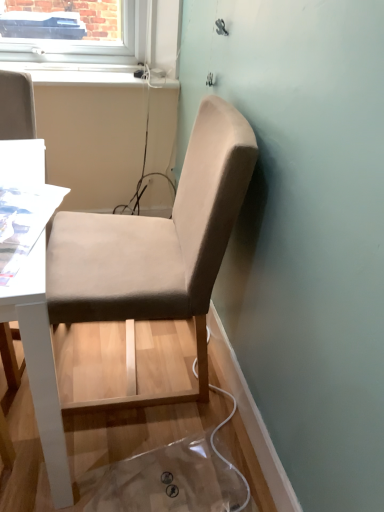
Question: Can you confirm if white plastic window sill at upper center is shorter than beige fabric chair at center?

Choices:
 (A) no
 (B) yes

Answer: (B)

Question: Is white plastic window sill at upper center wider than beige fabric chair at center?

Choices:
 (A) no
 (B) yes

Answer: (A)

Question: Is white plastic window sill at upper center at the left side of beige fabric chair at center?

Choices:
 (A) yes
 (B) no

Answer: (A)

Question: Is the depth of white plastic window sill at upper center greater than that of beige fabric chair at center?

Choices:
 (A) no
 (B) yes

Answer: (B)

Question: Does white plastic window sill at upper center touch beige fabric chair at center?

Choices:
 (A) no
 (B) yes

Answer: (A)

Question: Is white plastic window sill at upper center smaller than beige fabric chair at center?

Choices:
 (A) no
 (B) yes

Answer: (B)

Question: From the image's perspective, is beige fabric chair at center on white plastic window sill at upper center?

Choices:
 (A) no
 (B) yes

Answer: (A)

Question: From the image's perspective, is beige fabric chair at center located beneath white plastic window sill at upper center?

Choices:
 (A) yes
 (B) no

Answer: (A)

Question: Is beige fabric chair at center taller than white plastic window sill at upper center?

Choices:
 (A) no
 (B) yes

Answer: (B)

Question: Is beige fabric chair at center positioned behind white plastic window sill at upper center?

Choices:
 (A) no
 (B) yes

Answer: (A)

Question: Does beige fabric chair at center have a lesser height compared to white plastic window sill at upper center?

Choices:
 (A) no
 (B) yes

Answer: (A)

Question: Is beige fabric chair at center aimed at white plastic window sill at upper center?

Choices:
 (A) yes
 (B) no

Answer: (B)

Question: From the image's perspective, is beige fabric chair at center located above or below white plastic window sill at upper center?

Choices:
 (A) below
 (B) above

Answer: (A)